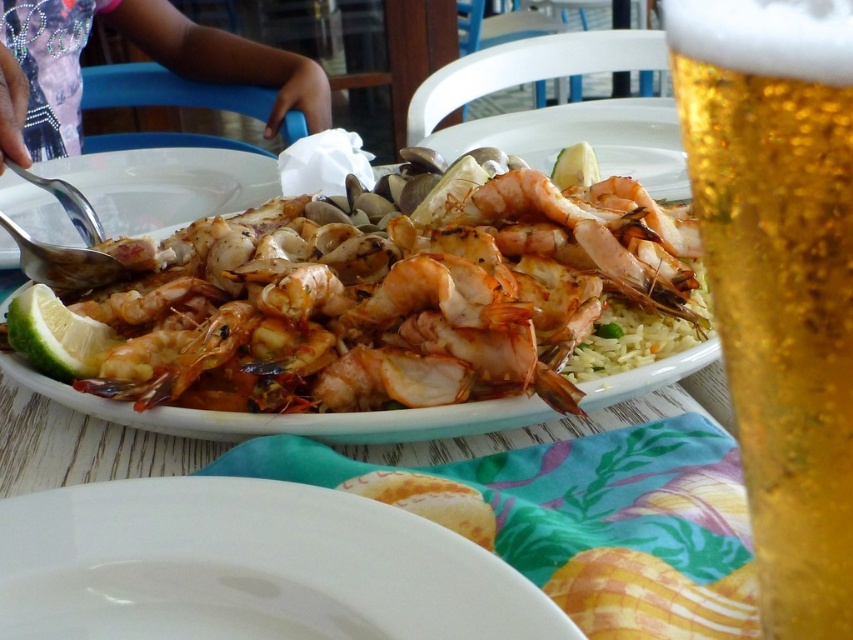
Is shiny ceramic plate at center thinner than matte white plate at upper left?

No, shiny ceramic plate at center is not thinner than matte white plate at upper left.

Who is more distant from viewer, (410, 232) or (148, 168)?

The point (148, 168) is more distant.

Which is behind, point (343, 365) or point (143, 205)?

Positioned behind is point (143, 205).

Identify the location of shiny ceramic plate at center. This screenshot has width=853, height=640. (370, 320).

Can you confirm if shiny ceramic plate at center is smaller than white glossy plate at center?

No, shiny ceramic plate at center is not smaller than white glossy plate at center.

Based on the photo, does shiny ceramic plate at center have a larger size compared to white glossy plate at center?

Yes.

Is point (440, 410) more distant than point (239, 637)?

Yes, point (440, 410) is behind point (239, 637).

Where is `shiny ceramic plate at center`? The height and width of the screenshot is (640, 853). shiny ceramic plate at center is located at coordinates (370, 320).

Who is more distant from viewer, (796, 330) or (254, 164)?

The point (254, 164) is behind.

Can you confirm if golden liquid beer at right is positioned to the left of matte white plate at upper left?

No, golden liquid beer at right is not to the left of matte white plate at upper left.

Locate an element on the screen. The height and width of the screenshot is (640, 853). golden liquid beer at right is located at coordinates (779, 275).